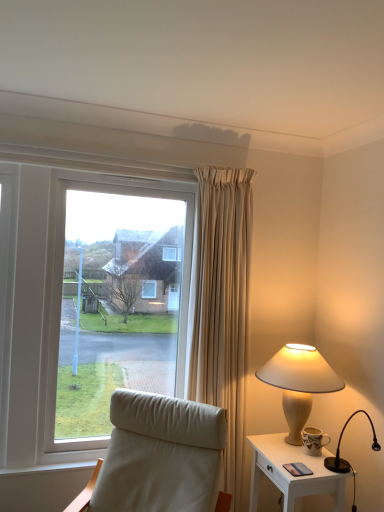
Question: Does black glossy lamp at right, which is the first lamp in front-to-back order, turn towards leather-like chair at lower left?

Choices:
 (A) no
 (B) yes

Answer: (A)

Question: Is leather-like chair at lower left located within black glossy lamp at right, placed as the 2th lamp when sorted from back to front?

Choices:
 (A) yes
 (B) no

Answer: (B)

Question: Is black glossy lamp at right, which is the first lamp in front-to-back order, wider than leather-like chair at lower left?

Choices:
 (A) no
 (B) yes

Answer: (A)

Question: Is black glossy lamp at right, placed as the 2th lamp when sorted from back to front, behind leather-like chair at lower left?

Choices:
 (A) yes
 (B) no

Answer: (A)

Question: Does black glossy lamp at right, placed as the 2th lamp when sorted from back to front, have a smaller size compared to leather-like chair at lower left?

Choices:
 (A) no
 (B) yes

Answer: (B)

Question: Considering the relative sizes of black glossy lamp at right, which is the first lamp in front-to-back order, and leather-like chair at lower left in the image provided, is black glossy lamp at right, which is the first lamp in front-to-back order, bigger than leather-like chair at lower left?

Choices:
 (A) no
 (B) yes

Answer: (A)

Question: From a real-world perspective, is matte beige lamp at right, marked as the 1th lamp in a back-to-front arrangement, on top of white glossy nightstand at lower right?

Choices:
 (A) no
 (B) yes

Answer: (B)

Question: Can you confirm if matte beige lamp at right, which ranks as the 2th lamp in front-to-back order, is positioned to the right of white glossy nightstand at lower right?

Choices:
 (A) yes
 (B) no

Answer: (A)

Question: Does matte beige lamp at right, which ranks as the 2th lamp in front-to-back order, have a lesser width compared to white glossy nightstand at lower right?

Choices:
 (A) no
 (B) yes

Answer: (A)

Question: Is the depth of matte beige lamp at right, marked as the 1th lamp in a back-to-front arrangement, less than that of white glossy nightstand at lower right?

Choices:
 (A) no
 (B) yes

Answer: (A)

Question: Is matte beige lamp at right, marked as the 1th lamp in a back-to-front arrangement, outside of white glossy nightstand at lower right?

Choices:
 (A) no
 (B) yes

Answer: (B)

Question: Is white glossy nightstand at lower right inside matte beige lamp at right, marked as the 1th lamp in a back-to-front arrangement?

Choices:
 (A) no
 (B) yes

Answer: (A)

Question: Does white glossy nightstand at lower right appear on the right side of black glossy lamp at right, which is the first lamp in front-to-back order?

Choices:
 (A) yes
 (B) no

Answer: (B)